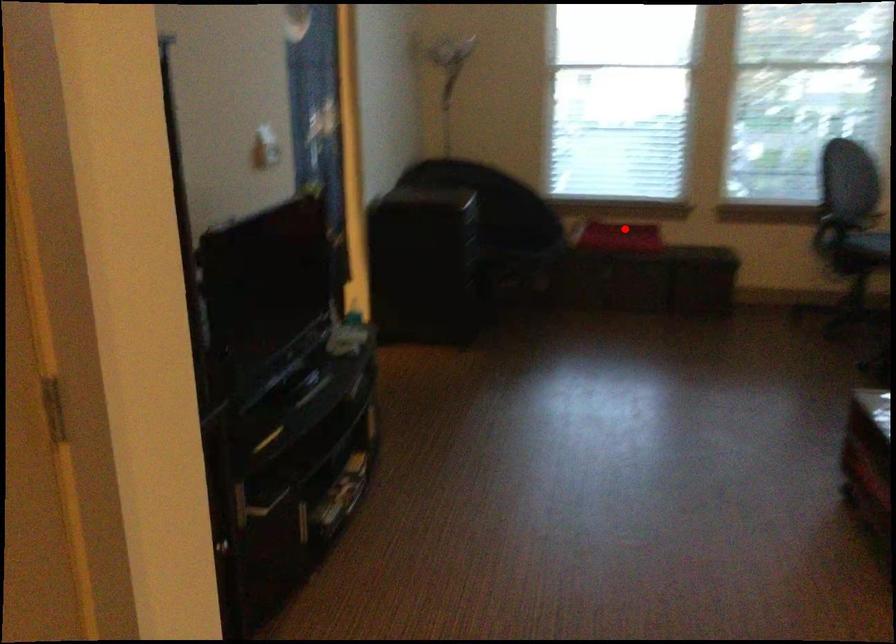
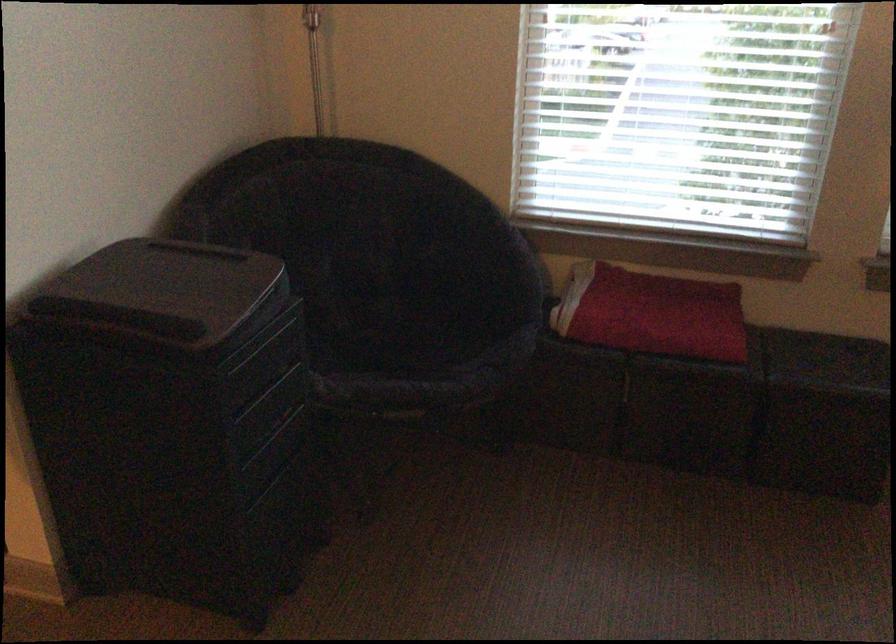
Question: I am providing you with two images of the same scene from different viewpoints. Image1 has a red point marked. In image2, the corresponding 3D location appears at what relative position? Reply with the corresponding letter.

Choices:
 (A) Closer
 (B) Farther

Answer: (A)